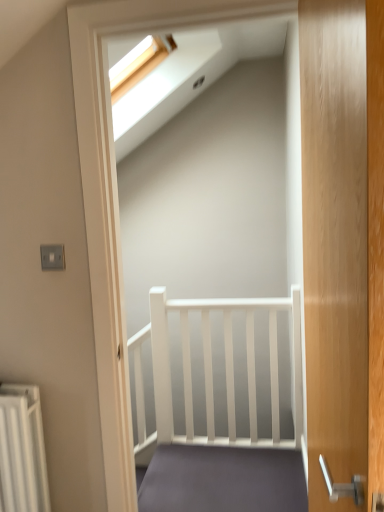
Question: Considering the positions of wooden door at right and matte gray carpet at center in the image, is wooden door at right bigger or smaller than matte gray carpet at center?

Choices:
 (A) small
 (B) big

Answer: (B)

Question: Is wooden door at right taller or shorter than matte gray carpet at center?

Choices:
 (A) short
 (B) tall

Answer: (B)

Question: Choose the correct answer: Is wooden door at right inside matte gray carpet at center or outside it?

Choices:
 (A) outside
 (B) inside

Answer: (A)

Question: Which is correct: matte gray carpet at center is inside wooden door at right, or outside of it?

Choices:
 (A) outside
 (B) inside

Answer: (A)

Question: Is point (193, 480) closer or farther from the camera than point (345, 201)?

Choices:
 (A) closer
 (B) farther

Answer: (B)

Question: Considering the positions of matte gray carpet at center and wooden door at right in the image, is matte gray carpet at center wider or thinner than wooden door at right?

Choices:
 (A) wide
 (B) thin

Answer: (A)

Question: Is matte gray carpet at center taller or shorter than wooden door at right?

Choices:
 (A) tall
 (B) short

Answer: (B)